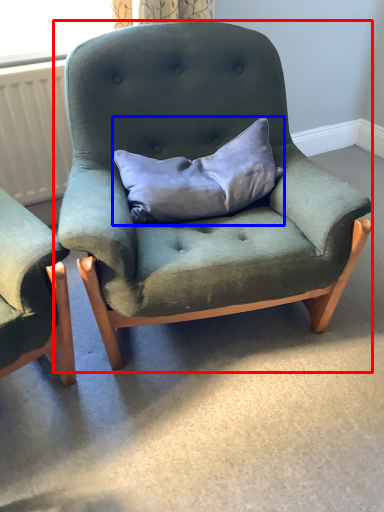
Question: Which object appears closest to the camera in this image, chair (highlighted by a red box) or pillow (highlighted by a blue box)?

Choices:
 (A) chair
 (B) pillow

Answer: (A)